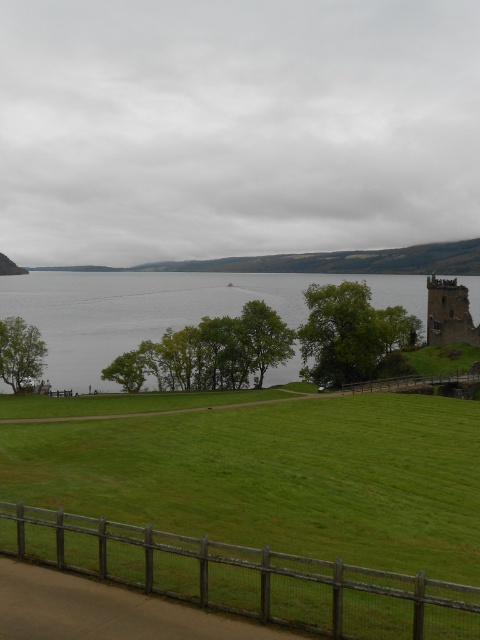
You are standing at the wooden fence and want to take a photo of both the point at coordinates point (x=29, y=304) and the point at coordinates point (x=369, y=388). Which point will appear closer to the camera in the photo?

Point (x=29, y=304) will appear closer to the camera in the photo because it is further to the camera than point (x=369, y=388).